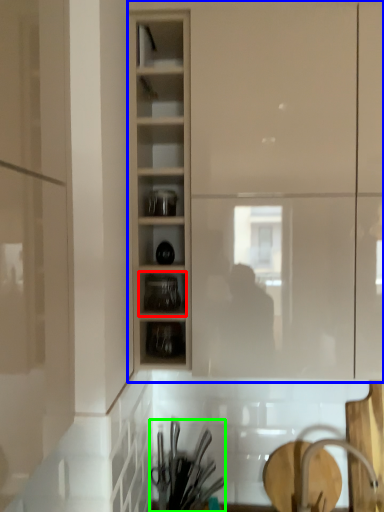
Question: Which object is positioned closest to shelf (highlighted by a red box)? Select from cupboard (highlighted by a blue box) and tableware (highlighted by a green box).

Choices:
 (A) cupboard
 (B) tableware

Answer: (A)